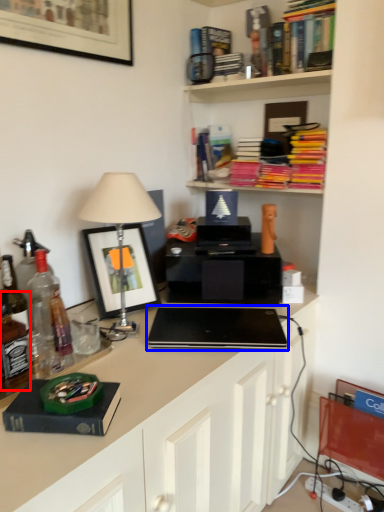
Question: Which object appears closest to the camera in this image, wine bottle (highlighted by a red box) or laptop (highlighted by a blue box)?

Choices:
 (A) wine bottle
 (B) laptop

Answer: (A)